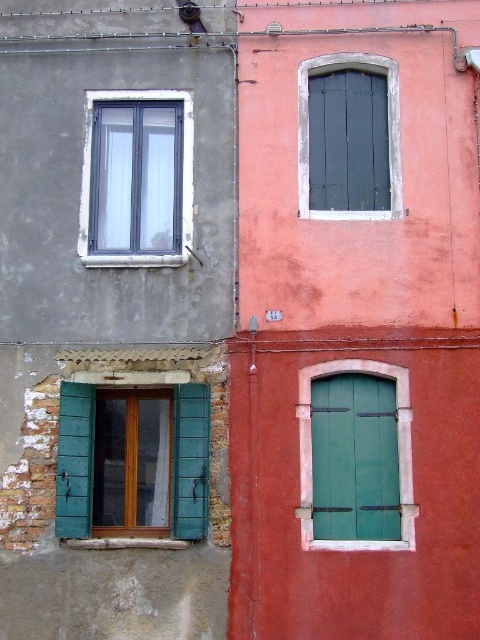
Question: Which point appears farthest from the camera in this image?

Choices:
 (A) (83, 163)
 (B) (345, 54)
 (C) (304, 472)

Answer: (B)

Question: Does matte black window at center have a smaller size compared to white plastic window at upper left?

Choices:
 (A) yes
 (B) no

Answer: (B)

Question: Is green wooden window at center bigger than green matte door at center?

Choices:
 (A) no
 (B) yes

Answer: (A)

Question: Which point is closer to the camera taking this photo?

Choices:
 (A) (394, 60)
 (B) (406, 518)
 (C) (199, 438)
 (D) (126, 257)

Answer: (B)

Question: Which of the following is the farthest from the observer?

Choices:
 (A) green wooden window at center
 (B) white plastic window at upper left
 (C) green matte door at center
 (D) matte black window at center

Answer: (B)

Question: Does matte black window at center have a larger size compared to white plastic window at upper left?

Choices:
 (A) yes
 (B) no

Answer: (A)